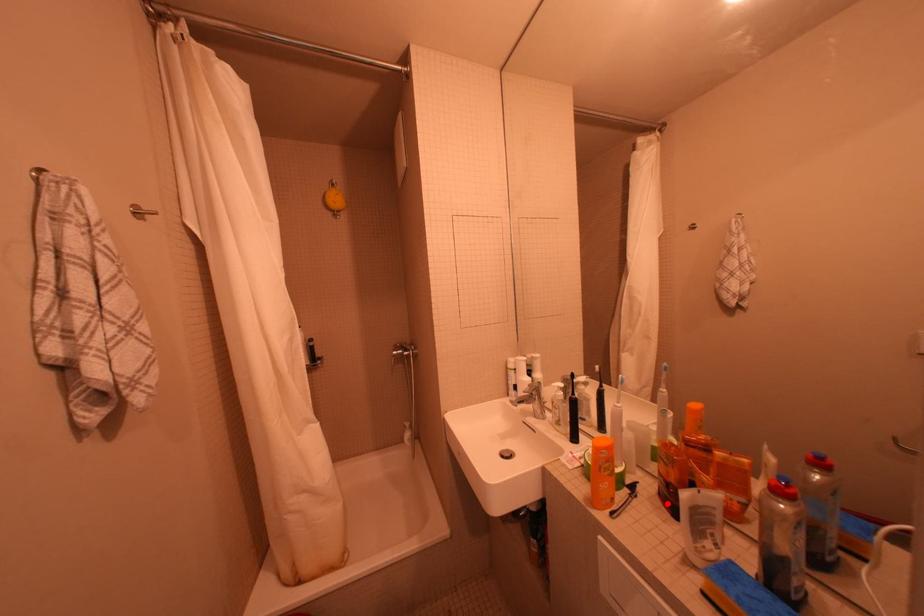
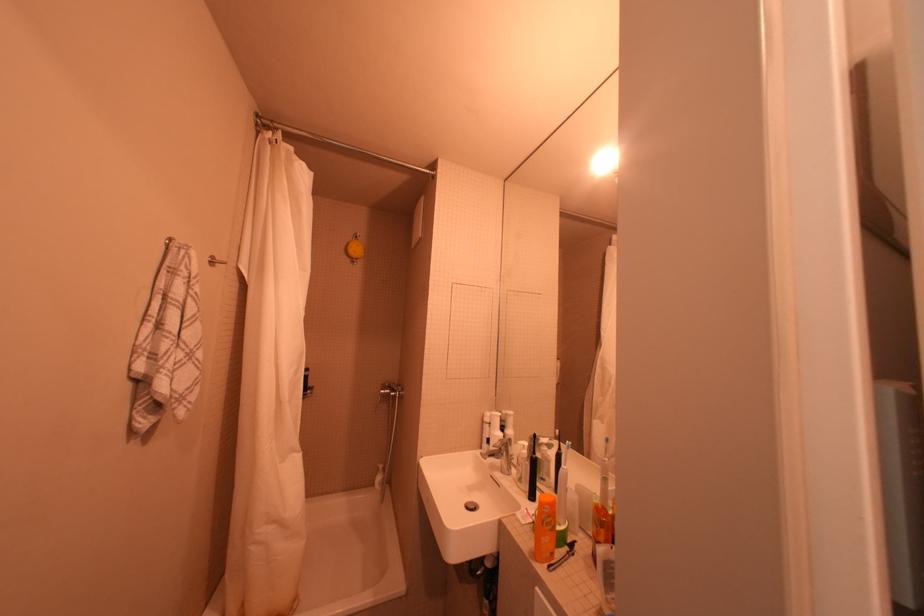
Where in the second image is the point corresponding to the highlighted location from the first image?

(600, 564)